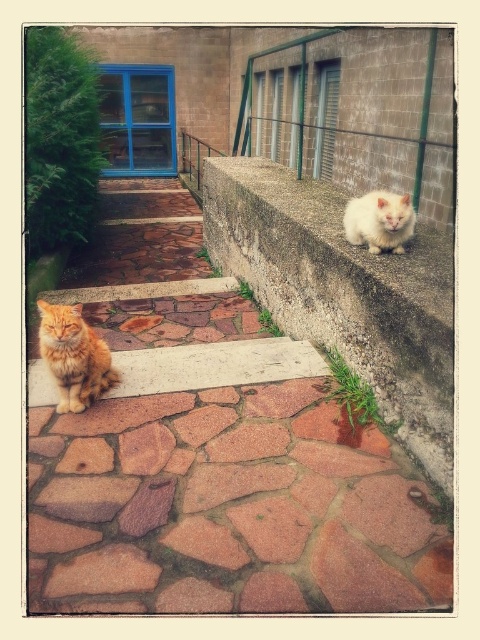
Can you confirm if white concrete ledge at upper right is wider than white fluffy cat at upper right?

Correct, the width of white concrete ledge at upper right exceeds that of white fluffy cat at upper right.

Does white concrete ledge at upper right have a lesser width compared to white fluffy cat at upper right?

No, white concrete ledge at upper right is not thinner than white fluffy cat at upper right.

Image resolution: width=480 pixels, height=640 pixels. Find the location of `white concrete ledge at upper right`. white concrete ledge at upper right is located at coordinates (343, 292).

Is white concrete ledge at upper right shorter than orange fur cat at left?

No.

Is point (379, 262) farther from camera compared to point (84, 392)?

That is True.

At what (x,y) coordinates should I click in order to perform the action: click on white concrete ledge at upper right. Please return your answer as a coordinate pair (x, y). Looking at the image, I should click on (343, 292).

Based on the photo, does orange fur cat at left have a larger size compared to white fluffy cat at upper right?

No.

Which is in front, point (73, 360) or point (410, 204)?

Point (73, 360) is more forward.

Identify the location of orange fur cat at left. (73, 355).